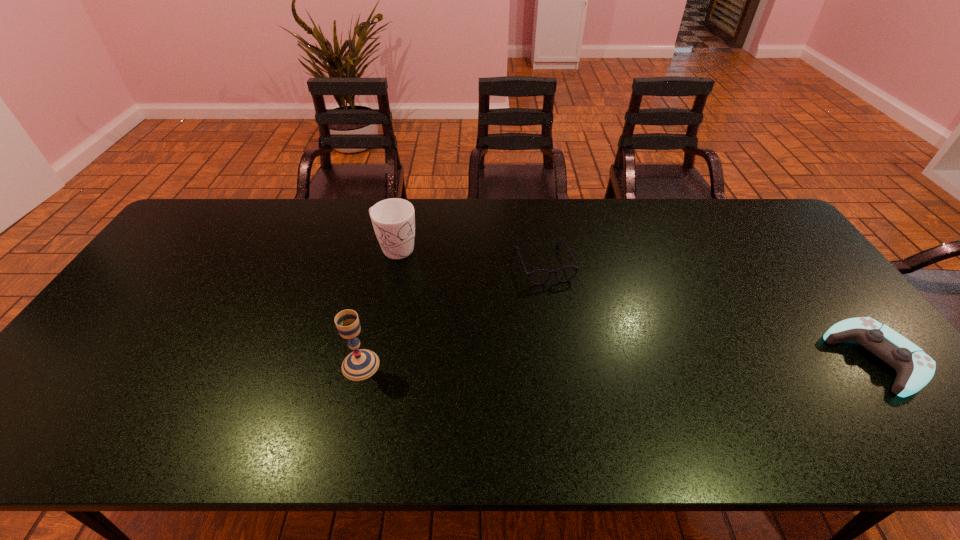
Locate an element on the screen. free space on the desktop that is between the chalice and the control and is positioned on the front-facing side of the spectacles is located at coordinates (586, 362).

Where is `vacant spot on the desktop that is between the chalice and the control and is positioned on the side of the mug with the handle`? This screenshot has width=960, height=540. vacant spot on the desktop that is between the chalice and the control and is positioned on the side of the mug with the handle is located at coordinates (574, 362).